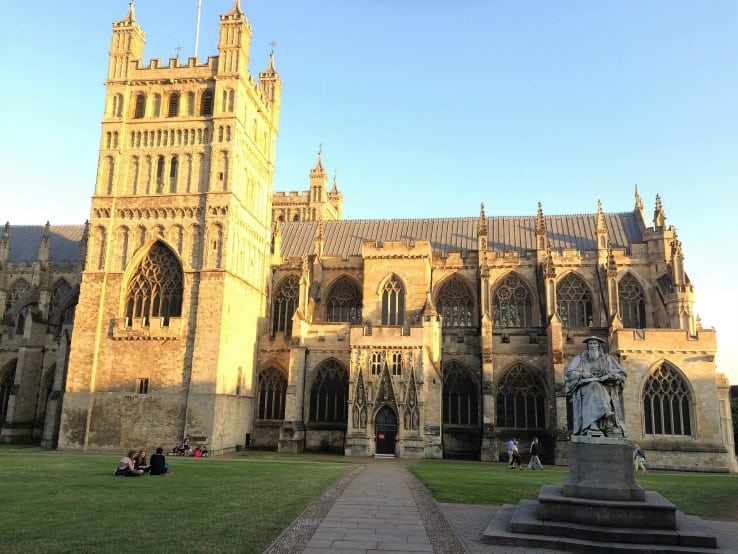
This screenshot has width=738, height=554. What are the coordinates of `statue` in the screenshot? It's located at (596, 389).